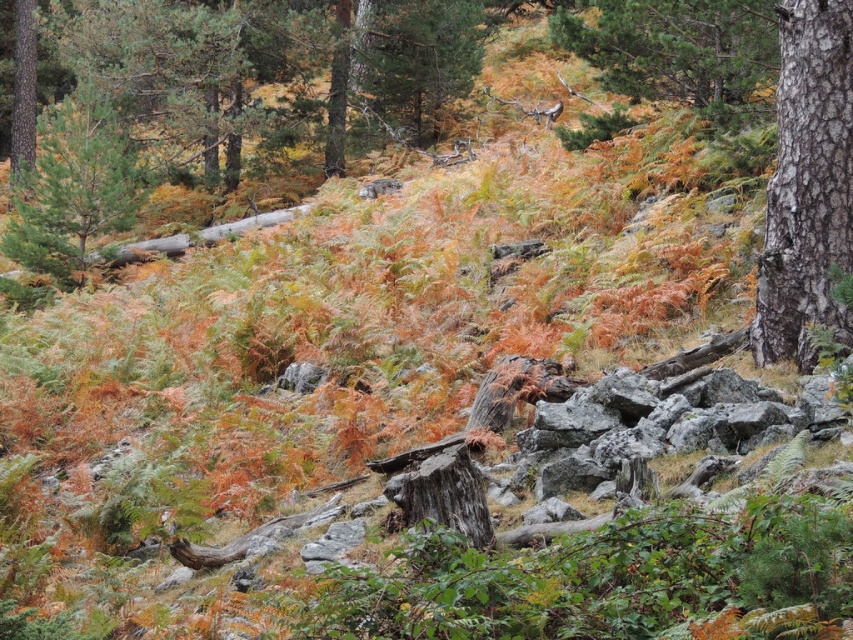
You are an artist trying to sketch this forest scene. You notice the green matte tree at left and the smooth brown tree trunk at left. Which one should you draw first if you want to capture the larger object first?

The green matte tree at left has a larger size compared to the smooth brown tree trunk at left, so you should draw the green matte tree at left first to capture the larger object first.